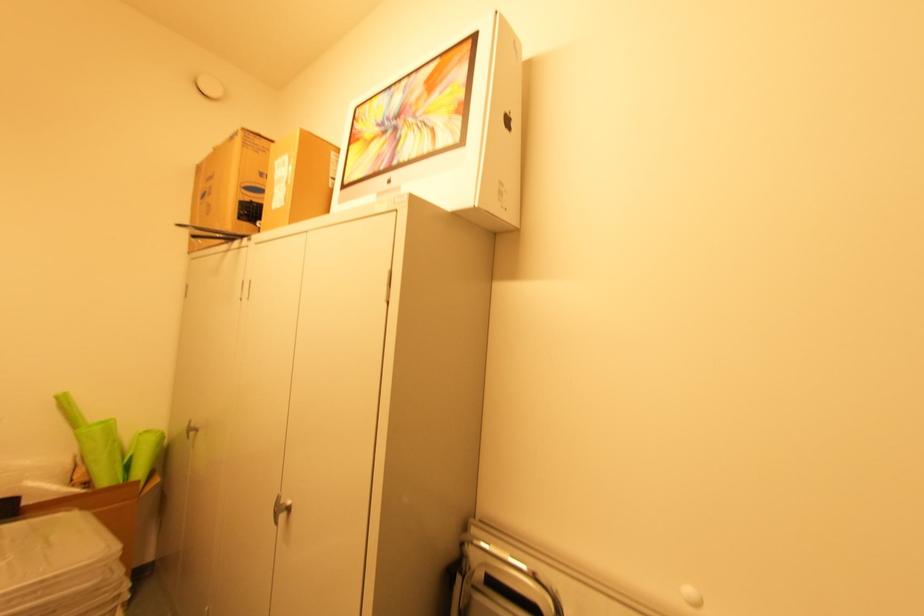
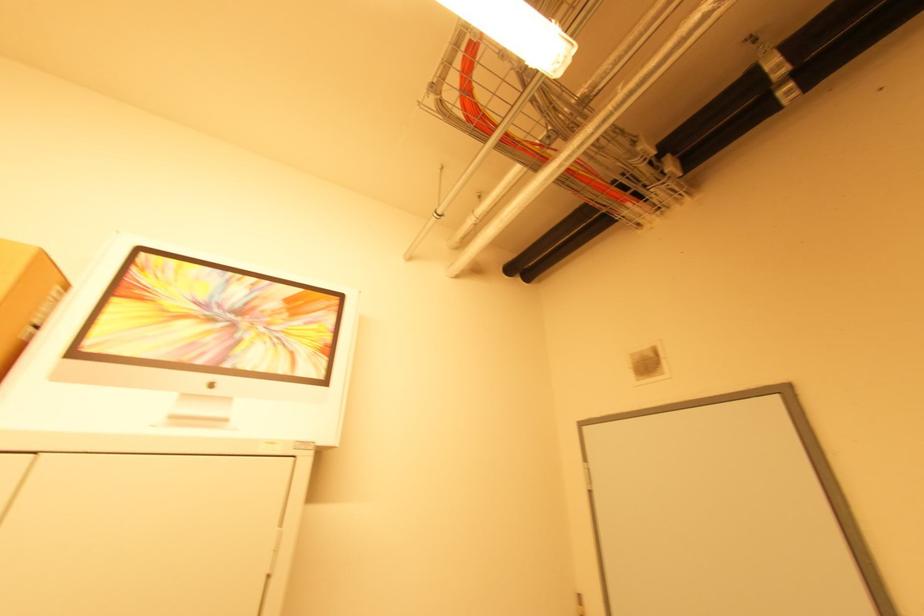
How did the camera likely rotate?

The camera rotated toward right-up.